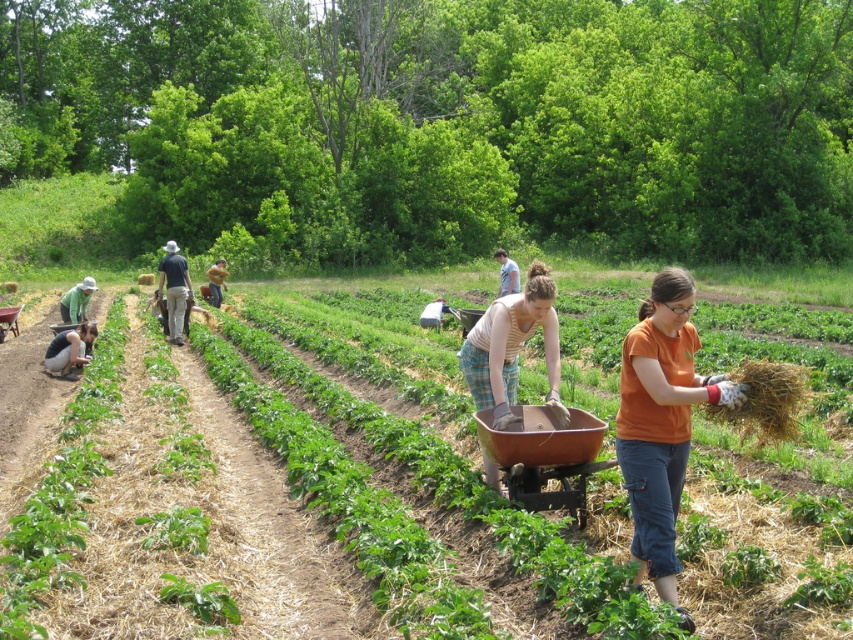
You are a farmer who needs to distribute straw evenly between the two workers in the field. The workers are wearing the striped cotton shirt at center and the dark blue shirt at center. Based on their positions, which worker is positioned higher and should receive more straw?

The striped cotton shirt at center is located above the dark blue shirt at center, so the worker in the striped cotton shirt at center should receive more straw as they are positioned higher.

You are standing at the edge of the agricultural field described. You see the dark blue shirt at center. Can you reach it without moving from your current position?

The dark blue shirt at center is 16.07 meters away from viewer, so you cannot reach it without moving from your current position.

You are a farmer who needs to determine which worker has a wider torso to assign appropriate tasks. Based on the image, which worker has a wider torso between the dark blue shirt at center and the green plaid shirt at center?

The green plaid shirt at center has a wider torso than the dark blue shirt at center since its width is greater.